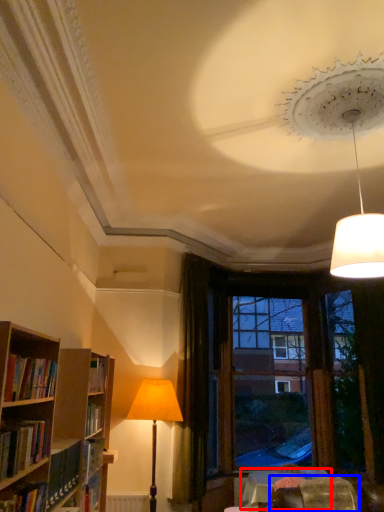
Question: Which object appears closest to the camera in this image, table (highlighted by a red box) or swivel chair (highlighted by a blue box)?

Choices:
 (A) table
 (B) swivel chair

Answer: (B)